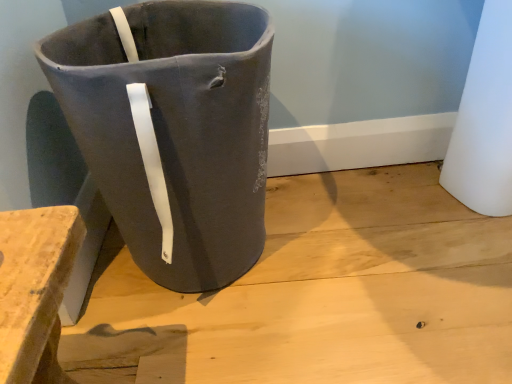
You are a GUI agent. You are given a task and a screenshot of the screen. Output one action in this format:
    pyautogui.click(x=<x>, y=<y>)
    Task: Click on the matte gray concrete at center
    This screenshot has height=384, width=512.
    Given the screenshot: What is the action you would take?
    pyautogui.click(x=319, y=295)

Looking at this image, what is the approximate height of matte gray concrete at center?

It is 1.31 inches.

Describe the element at coordinates (319, 295) in the screenshot. This screenshot has height=384, width=512. I see `matte gray concrete at center` at that location.

I want to click on matte gray fabric bag at center, so click(x=173, y=130).

Describe the element at coordinates (173, 130) in the screenshot. I see `matte gray fabric bag at center` at that location.

Where is `matte gray concrete at center`? This screenshot has width=512, height=384. matte gray concrete at center is located at coordinates (319, 295).

Would you say matte gray concrete at center is to the left or to the right of matte gray fabric bag at center in the picture?

From the image, it's evident that matte gray concrete at center is to the right of matte gray fabric bag at center.

Based on the photo, who is more distant, matte gray concrete at center or matte gray fabric bag at center?

matte gray concrete at center is behind.

Which point is more distant from viewer, (475, 350) or (156, 204)?

The point (475, 350) is behind.

From the image's perspective, is matte gray concrete at center positioned above or below matte gray fabric bag at center?

matte gray concrete at center is situated lower than matte gray fabric bag at center in the image.

From a real-world perspective, does matte gray concrete at center stand above matte gray fabric bag at center?

No, from a real-world perspective, matte gray concrete at center is not over matte gray fabric bag at center

Is matte gray concrete at center thinner than matte gray fabric bag at center?

No.

Is matte gray concrete at center taller or shorter than matte gray fabric bag at center?

Clearly, matte gray concrete at center is shorter compared to matte gray fabric bag at center.

Is matte gray concrete at center smaller than matte gray fabric bag at center?

Correct, matte gray concrete at center occupies less space than matte gray fabric bag at center.

Can we say matte gray concrete at center lies outside matte gray fabric bag at center?

Yes, matte gray concrete at center is located beyond the bounds of matte gray fabric bag at center.

Does matte gray concrete at center touch matte gray fabric bag at center?

matte gray concrete at center and matte gray fabric bag at center are clearly separated.

Is matte gray concrete at center aimed at matte gray fabric bag at center?

No, matte gray concrete at center is not oriented towards matte gray fabric bag at center.

How much distance is there between matte gray concrete at center and matte gray fabric bag at center?

The distance of matte gray concrete at center from matte gray fabric bag at center is 29.29 centimeters.

At what (x,y) coordinates should I click in order to perform the action: click on waste container located above the matte gray concrete at center (from a real-world perspective). Please return your answer as a coordinate pair (x, y). This screenshot has height=384, width=512. Looking at the image, I should click on (173, 130).

From the picture: Considering the relative positions of matte gray fabric bag at center and matte gray concrete at center in the image provided, is matte gray fabric bag at center to the left or to the right of matte gray concrete at center?

Clearly, matte gray fabric bag at center is on the left of matte gray concrete at center in the image.

Which is in front, matte gray fabric bag at center or matte gray concrete at center?

matte gray fabric bag at center.

Does point (121, 97) lie in front of point (401, 239)?

Yes, it is in front of point (401, 239).

From the picture: From the image's perspective, between matte gray fabric bag at center and matte gray concrete at center, who is located below?

matte gray concrete at center appears lower in the image.

From a real-world perspective, is matte gray fabric bag at center physically below matte gray concrete at center?

No, from a real-world perspective, matte gray fabric bag at center is not under matte gray concrete at center.

Considering the sizes of objects matte gray fabric bag at center and matte gray concrete at center in the image provided, who is wider, matte gray fabric bag at center or matte gray concrete at center?

matte gray concrete at center.

In terms of height, does matte gray fabric bag at center look taller or shorter compared to matte gray concrete at center?

Considering their sizes, matte gray fabric bag at center has more height than matte gray concrete at center.

Considering the relative sizes of matte gray fabric bag at center and matte gray concrete at center in the image provided, is matte gray fabric bag at center bigger than matte gray concrete at center?

Yes, matte gray fabric bag at center is bigger than matte gray concrete at center.

Is matte gray concrete at center inside matte gray fabric bag at center?

That's incorrect, matte gray concrete at center is not inside matte gray fabric bag at center.

Are matte gray fabric bag at center and matte gray concrete at center far apart?

No.

Does matte gray fabric bag at center turn towards matte gray concrete at center?

No, matte gray fabric bag at center is not aimed at matte gray concrete at center.

How different are the orientations of matte gray fabric bag at center and matte gray concrete at center in degrees?

2.99 degrees separate the facing orientations of matte gray fabric bag at center and matte gray concrete at center.

Locate an element on the screen. The image size is (512, 384). concrete on the right of matte gray fabric bag at center is located at coordinates (319, 295).

Locate an element on the screen. The image size is (512, 384). waste container in front of the matte gray concrete at center is located at coordinates (173, 130).

Find the location of `waste container above the matte gray concrete at center (from the image's perspective)`. waste container above the matte gray concrete at center (from the image's perspective) is located at coordinates (173, 130).